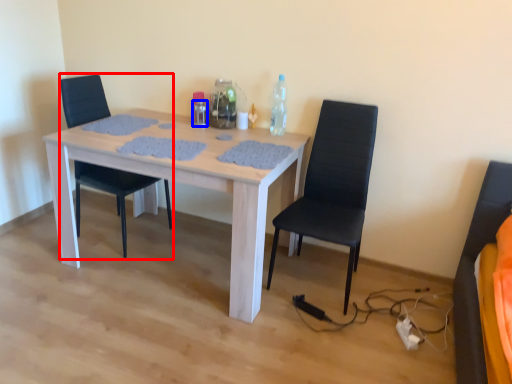
Question: Which of the following is the farthest to the observer, chair (highlighted by a red box) or bottle (highlighted by a blue box)?

Choices:
 (A) chair
 (B) bottle

Answer: (B)